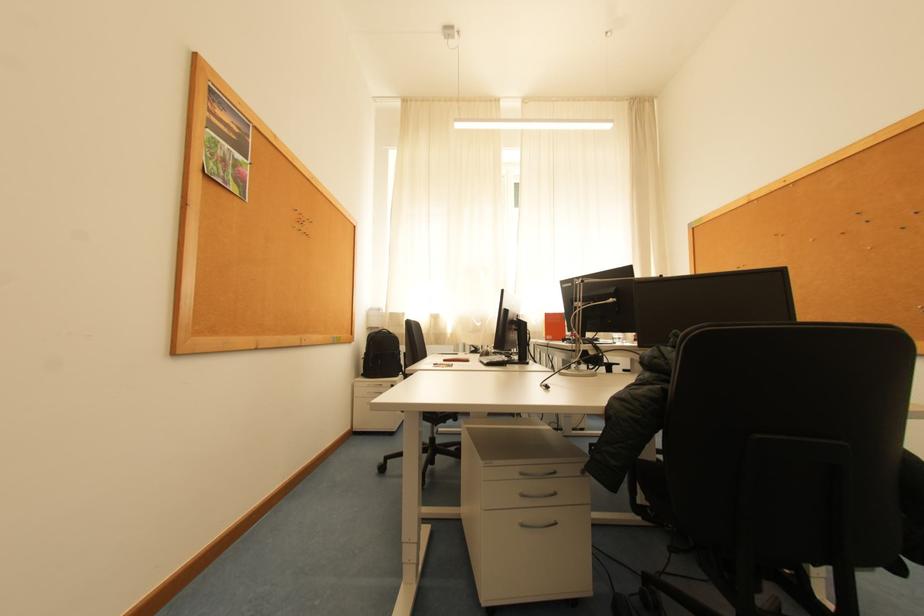
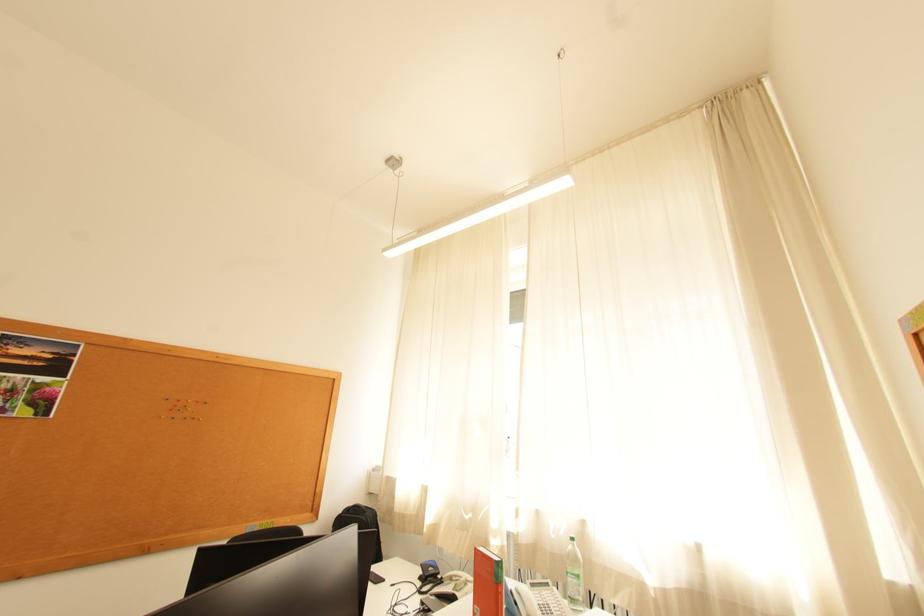
Where in the second image is the point corresponding to the point at 546,323 from the first image?

(569, 536)